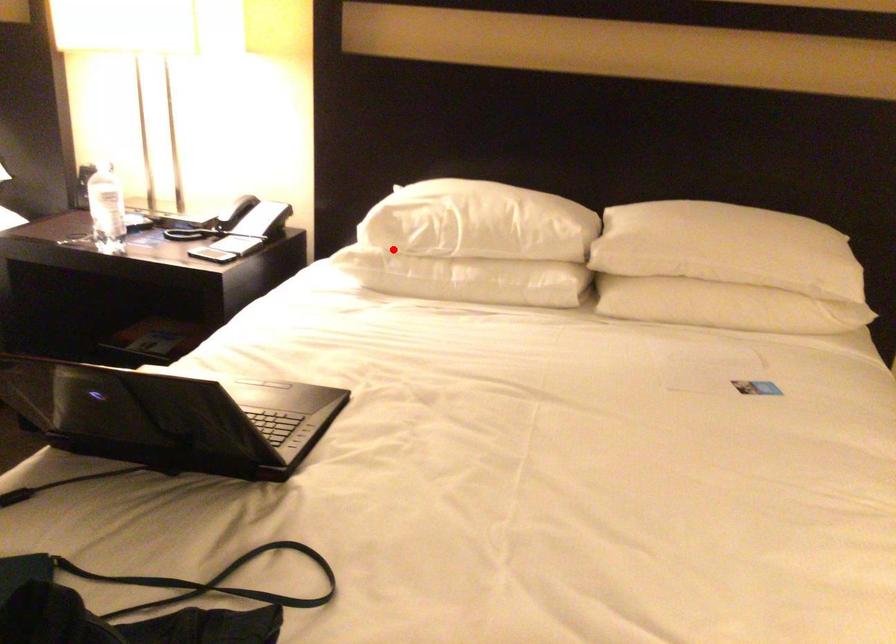
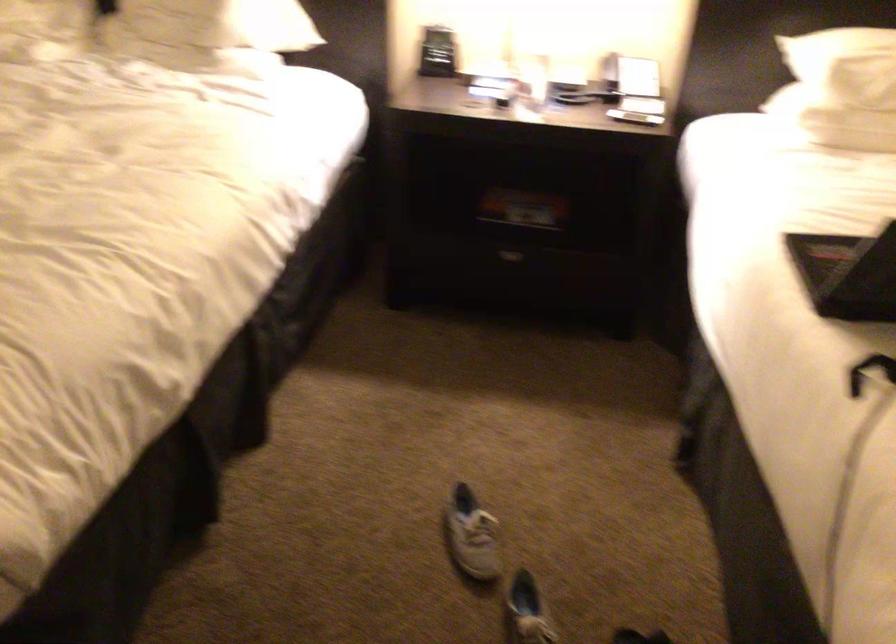
In the second image, find the point that corresponds to the highlighted location in the first image.

(858, 95)